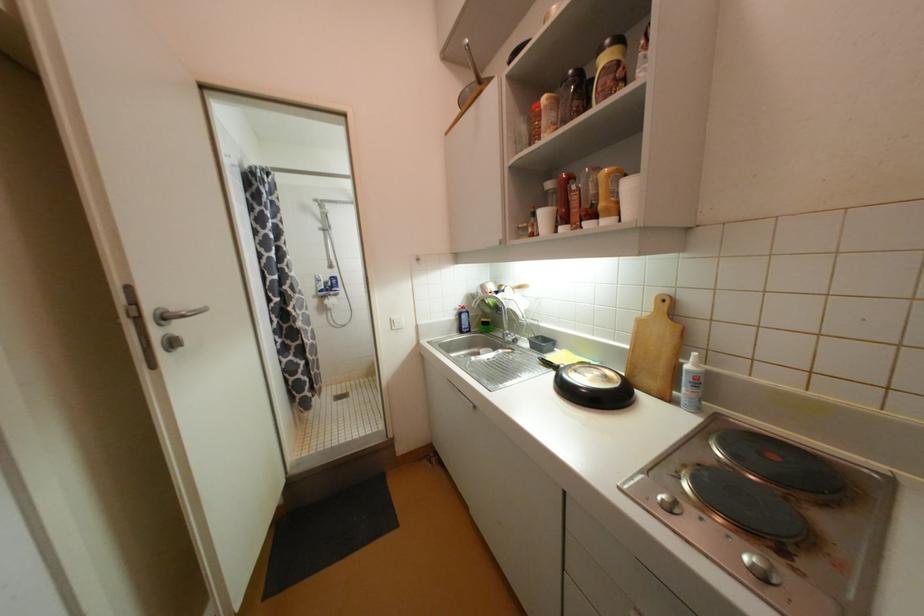
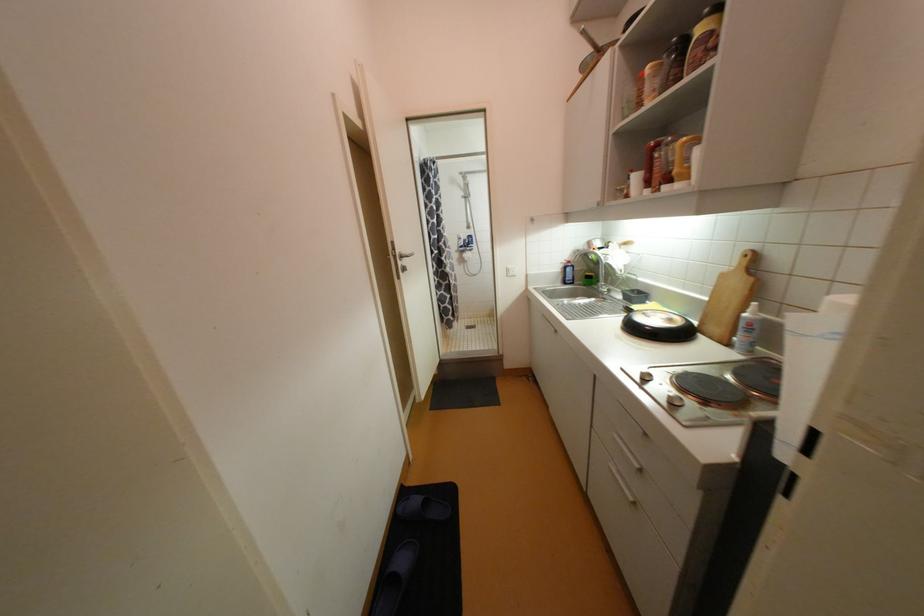
Locate, in the second image, the point that corresponds to [139,305] in the first image.

(398, 251)